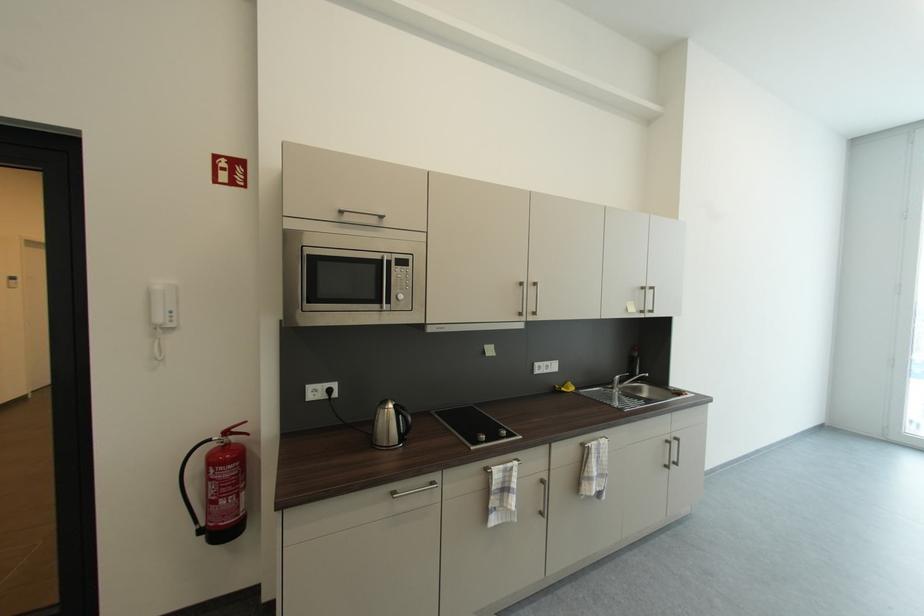
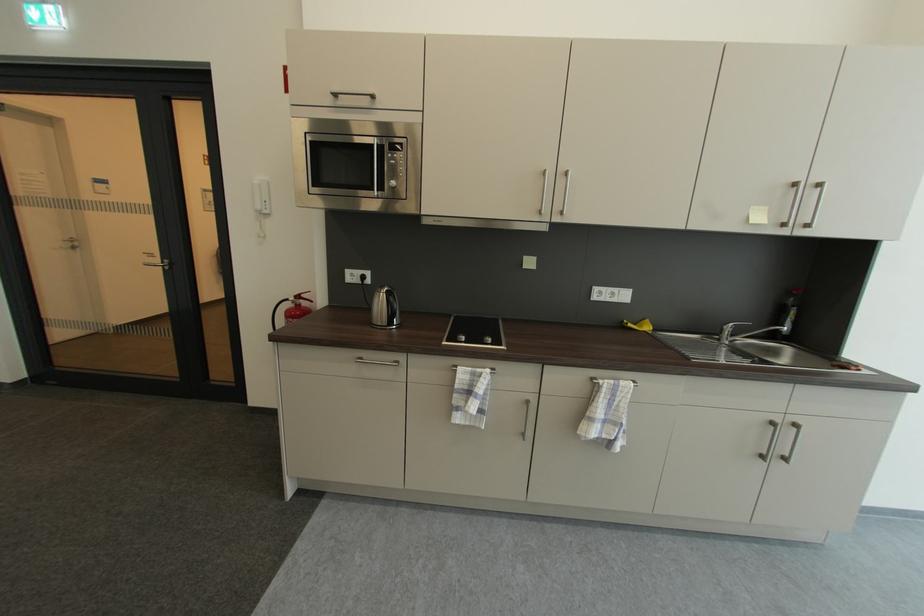
Where in the second image is the point corresponding to pixel 388 305 from the first image?

(380, 191)